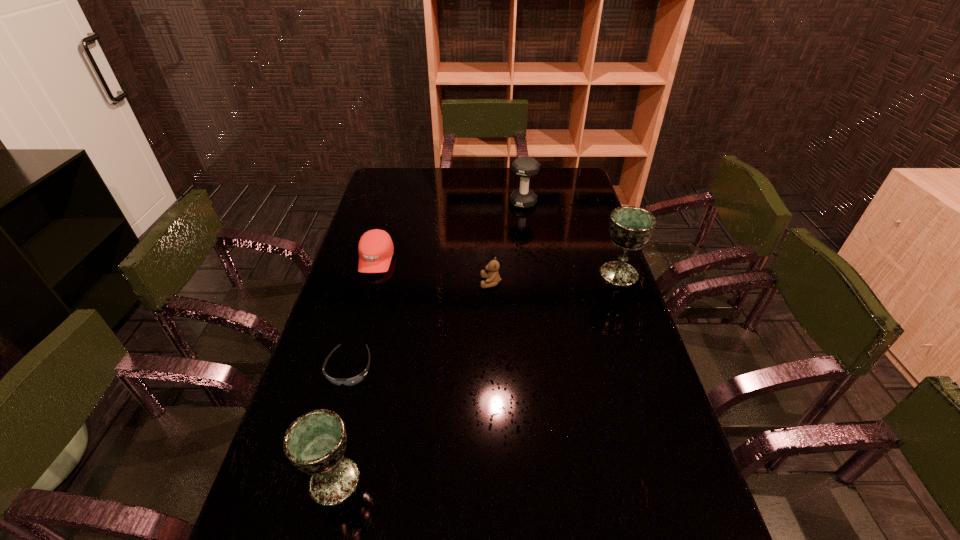
The height and width of the screenshot is (540, 960). Find the location of `the shorter chalice`. the shorter chalice is located at coordinates (315, 443).

Identify the location of the nearest object. Image resolution: width=960 pixels, height=540 pixels. (315, 443).

This screenshot has height=540, width=960. I want to click on the farther chalice, so click(x=630, y=227).

Image resolution: width=960 pixels, height=540 pixels. Find the location of `the right chalice`. the right chalice is located at coordinates (630, 227).

Where is `cap`? Image resolution: width=960 pixels, height=540 pixels. cap is located at coordinates (375, 247).

Locate an element on the screen. This screenshot has width=960, height=540. the second object from right to left is located at coordinates (525, 167).

At what (x,y) coordinates should I click in order to perform the action: click on dumbbell. Please return your answer as a coordinate pair (x, y). Looking at the image, I should click on (525, 167).

The image size is (960, 540). I want to click on the fifth farthest object, so click(x=355, y=380).

Where is `sunglasses`? Image resolution: width=960 pixels, height=540 pixels. sunglasses is located at coordinates (355, 380).

In order to click on teddy bear in this screenshot , I will do `click(493, 278)`.